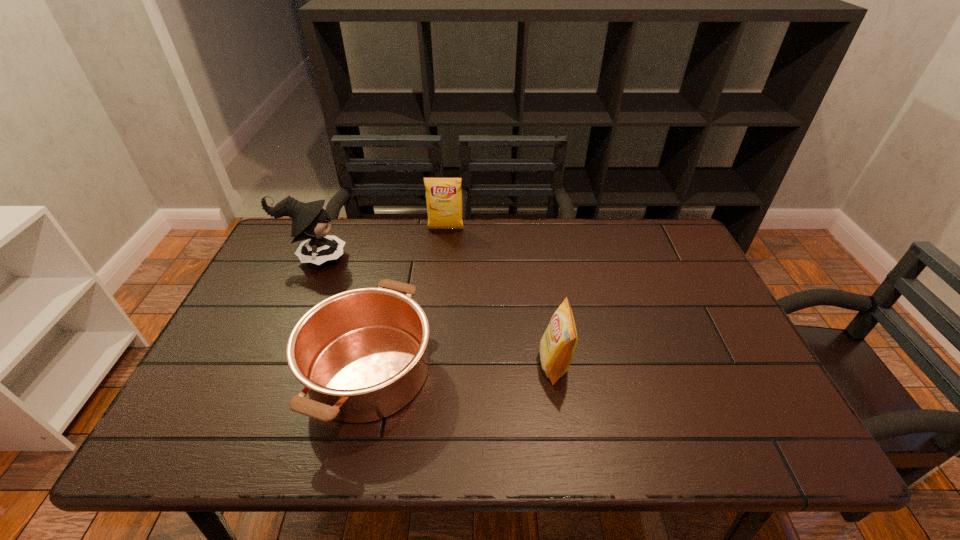
Find the location of a particular element. This screenshot has width=960, height=540. vacant space that satisfies the following two spatial constraints: 1. on the front-facing side of the right crisp (potato chip); 2. on the front side of the shortest object is located at coordinates (x=556, y=371).

Where is `vacant space that satisfies the following two spatial constraints: 1. at the face of the doll; 2. on the right side of the saucepan`? The width and height of the screenshot is (960, 540). vacant space that satisfies the following two spatial constraints: 1. at the face of the doll; 2. on the right side of the saucepan is located at coordinates (264, 371).

This screenshot has height=540, width=960. In order to click on blank area in the image that satisfies the following two spatial constraints: 1. at the face of the shortest object; 2. on the right side of the doll in this screenshot , I will do `click(264, 371)`.

Locate an element on the screen. free region that satisfies the following two spatial constraints: 1. on the front of the farthest object with the logo; 2. at the face of the third nearest object is located at coordinates (443, 258).